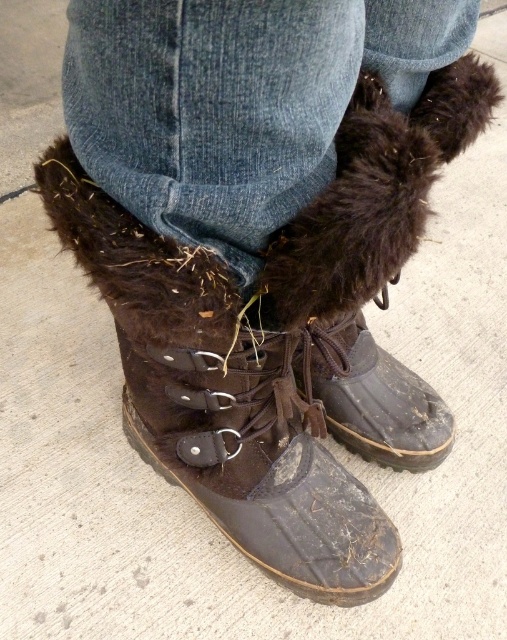
Who is shorter, brown suede boot at center or brown rubber boot at lower center?

brown rubber boot at lower center is shorter.

Who is taller, brown suede boot at center or brown rubber boot at lower center?

With more height is brown suede boot at center.

Where is `brown suede boot at center`? The image size is (507, 640). brown suede boot at center is located at coordinates (258, 461).

Where is `brown suede boot at center`? The image size is (507, 640). brown suede boot at center is located at coordinates (258, 461).